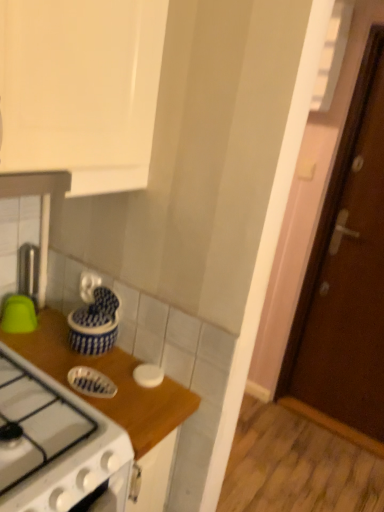
This screenshot has width=384, height=512. I want to click on free space in front of white matte lid at center, which is counted as the first kitchen appliance, starting from the right, so click(144, 404).